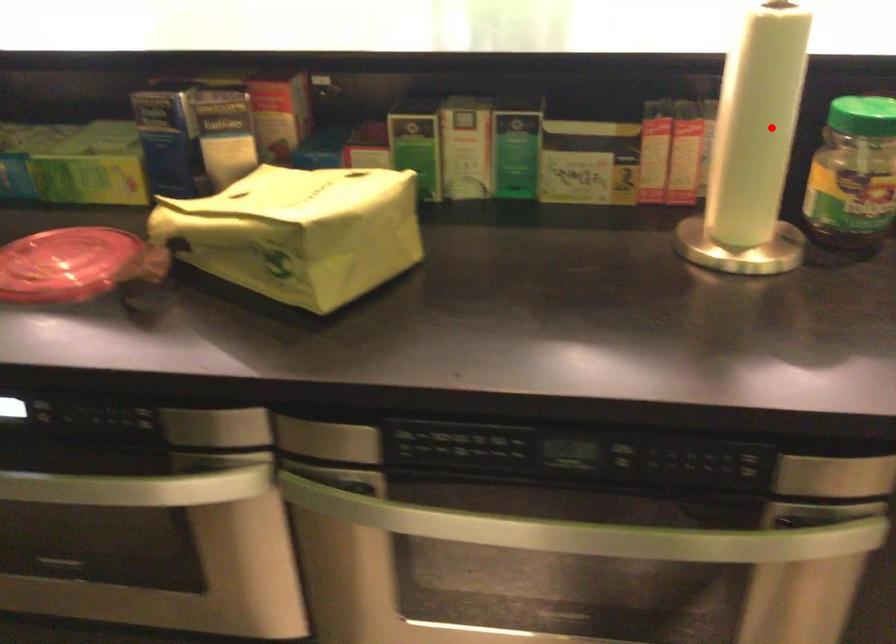
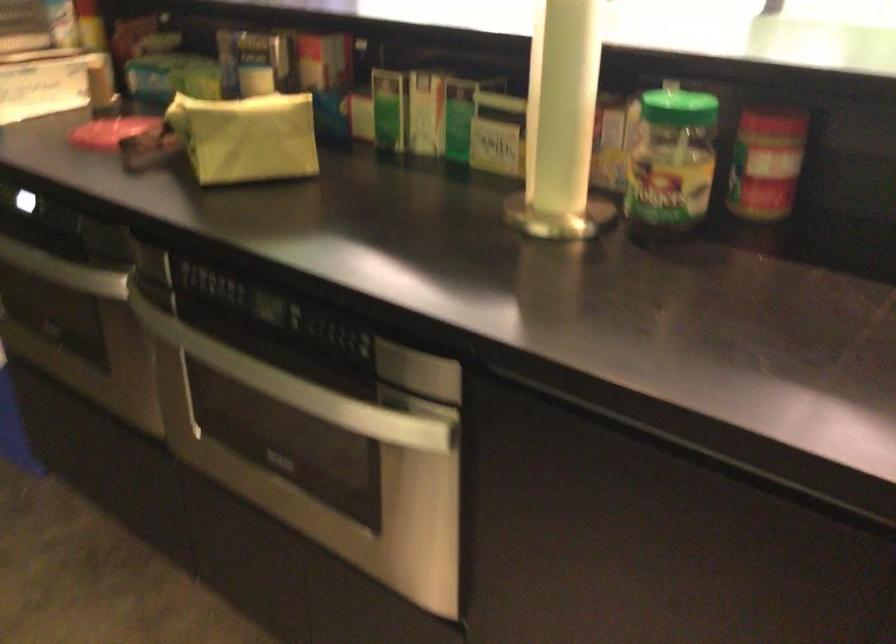
Find the pixel in the second image that matches the highlighted location in the first image.

(563, 102)